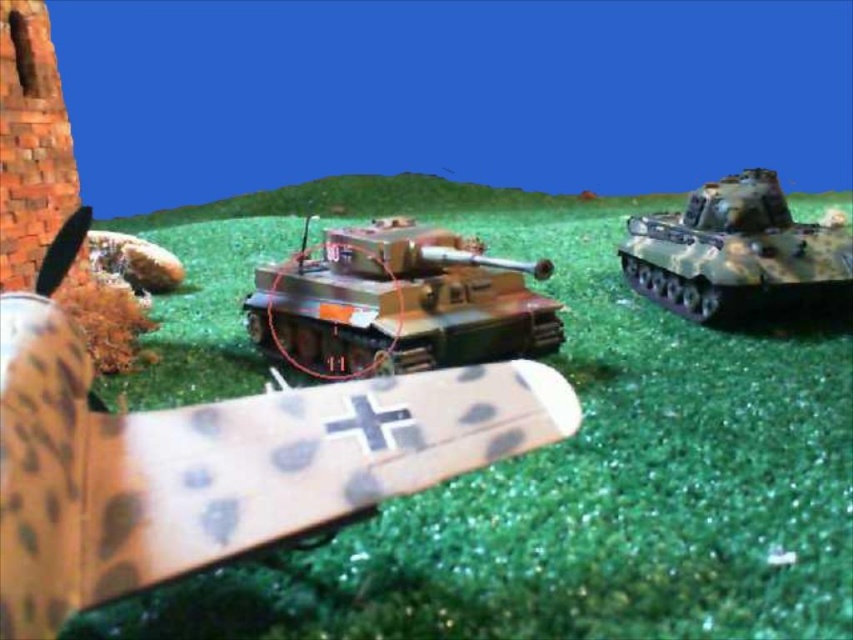
Question: Where is camouflage plastic tank at center located in relation to camouflage fabric tank at center in the image?

Choices:
 (A) left
 (B) right

Answer: (A)

Question: Is camouflage plastic tank at center above camouflage paint tank at center?

Choices:
 (A) yes
 (B) no

Answer: (B)

Question: Which point is farther to the camera?

Choices:
 (A) camouflage plastic tank at center
 (B) camouflage fabric tank at center

Answer: (B)

Question: From the image, what is the correct spatial relationship of camouflage plastic tank at center in relation to camouflage fabric tank at center?

Choices:
 (A) right
 (B) left

Answer: (B)

Question: Which point appears farthest from the camera in this image?

Choices:
 (A) (779, 227)
 (B) (54, 524)
 (C) (326, 339)

Answer: (A)

Question: Based on their relative distances, which object is farther from the camouflage plastic tank at center?

Choices:
 (A) camouflage paint tank at center
 (B) camouflage fabric tank at center

Answer: (B)